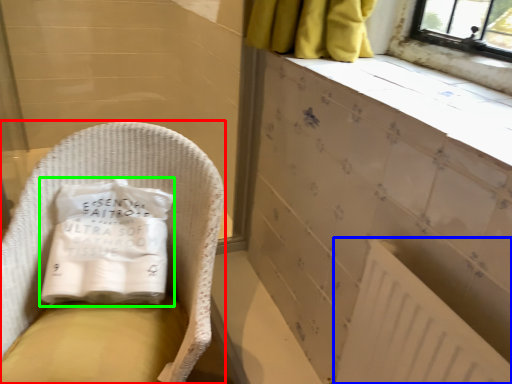
Question: Which is nearer to the furniture (highlighted by a red box)? radiator (highlighted by a blue box) or material (highlighted by a green box).

Choices:
 (A) radiator
 (B) material

Answer: (B)